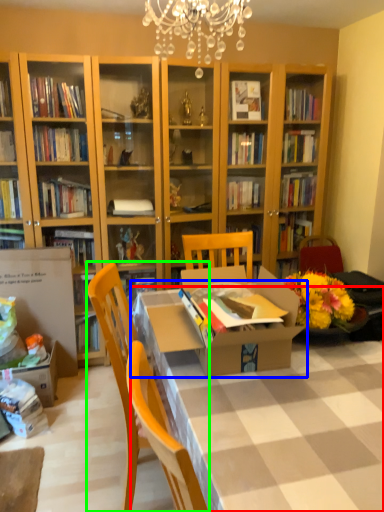
Question: Estimate the real-world distances between objects in this image. Which object is closer to desk (highlighted by a red box), table (highlighted by a blue box) or chair (highlighted by a green box)?

Choices:
 (A) table
 (B) chair

Answer: (A)